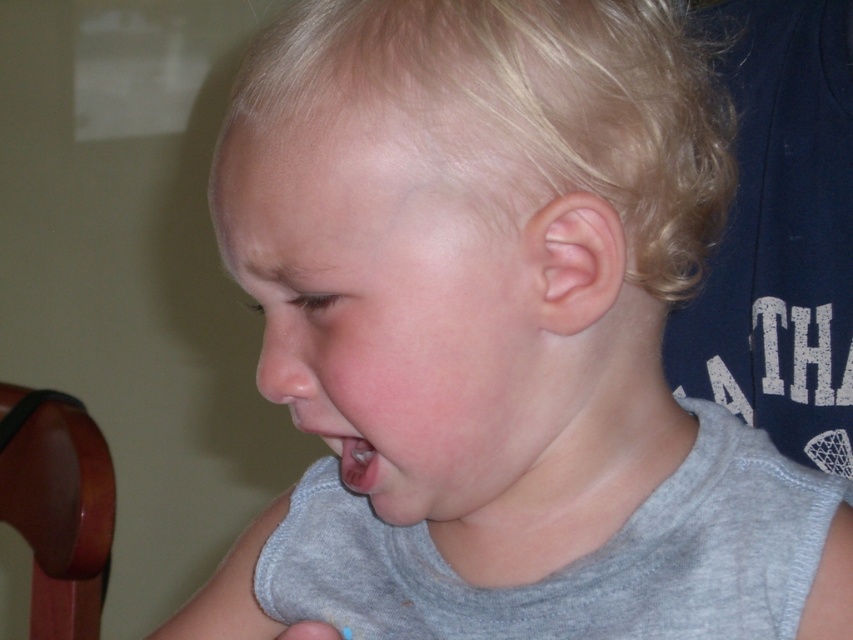
You are a photographer setting up a photo shoot. You have a brown wood chair at lower left and a pink flesh at center in your frame. Based on their heights, which object should you adjust to ensure both are visible in the shot?

The brown wood chair at lower left is taller than pink flesh at center, so you should lower the camera angle or adjust the chair position to ensure both are visible.

You are a photographer setting up for a portrait session. You need to position the brown wood chair at lower left and the pink flesh at center so that they are both visible in the frame. Considering their sizes, which object should you place closer to the camera to ensure both fit well in the shot?

Since the brown wood chair at lower left is bigger than pink flesh at center, you should place the brown wood chair at lower left farther from the camera and the pink flesh at center closer to the camera. This way, both objects will appear proportionally sized within the frame.